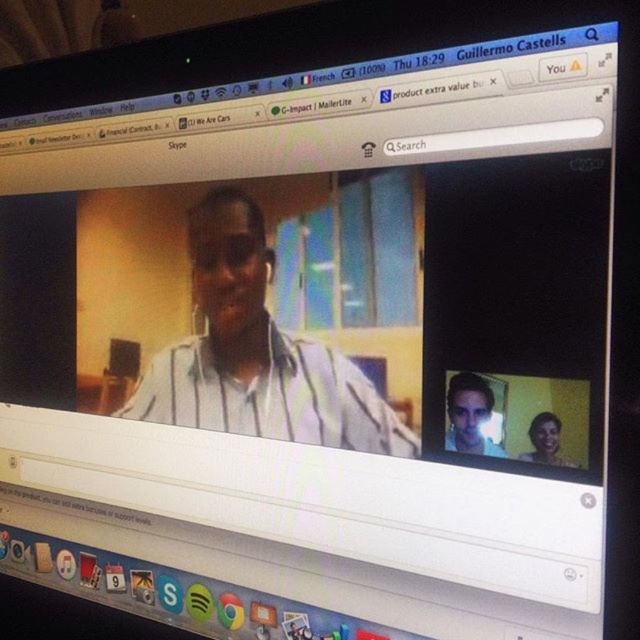
You are using a computer and see the screen described. You need to locate both the white striped shirt at center and the matte white shirt at upper right. Which one is positioned to the left of the other?

The white striped shirt at center is positioned to the left of the matte white shirt at upper right.

Looking at this image, you are setting up a video call and notice two matte white shirts on your screen. According to the scene, where is the matte white shirt at upper right in relation to the matte white shirt at lower right?

The matte white shirt at upper right is located above the matte white shirt at lower right.